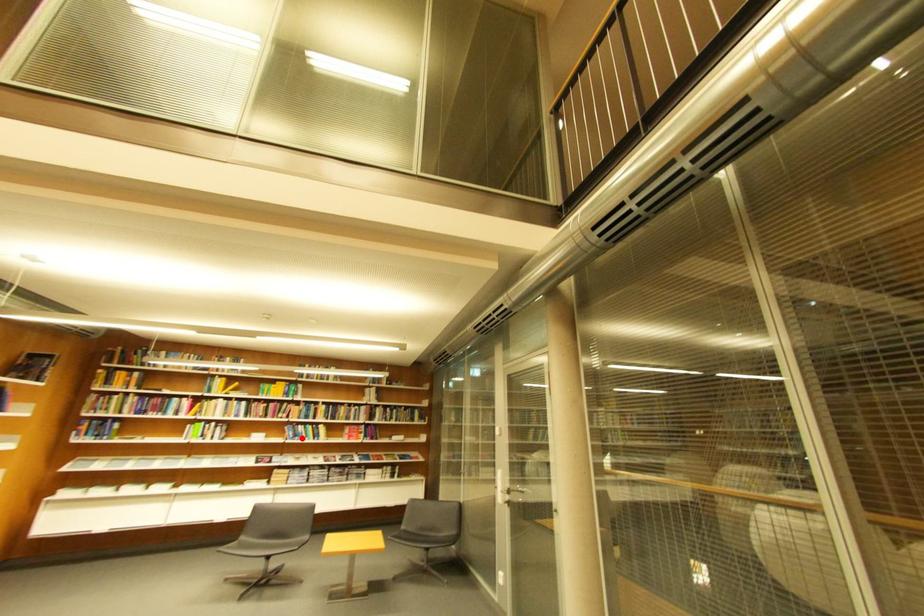
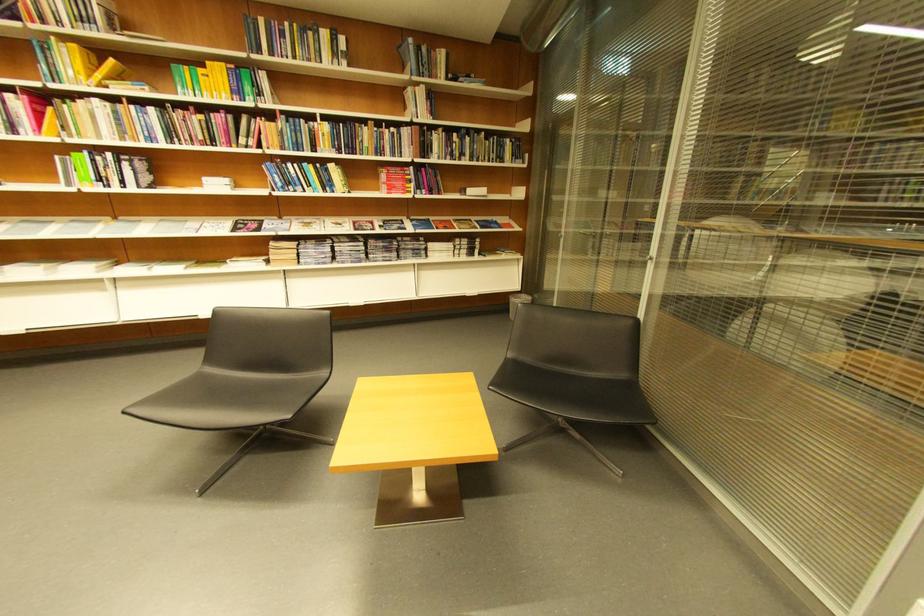
Question: A red point is marked in image1. In image2, is the corresponding 3D point closer to the camera or farther? Reply with the corresponding letter.

Choices:
 (A) The corresponding 3D point is closer.
 (B) The corresponding 3D point is farther.

Answer: (A)